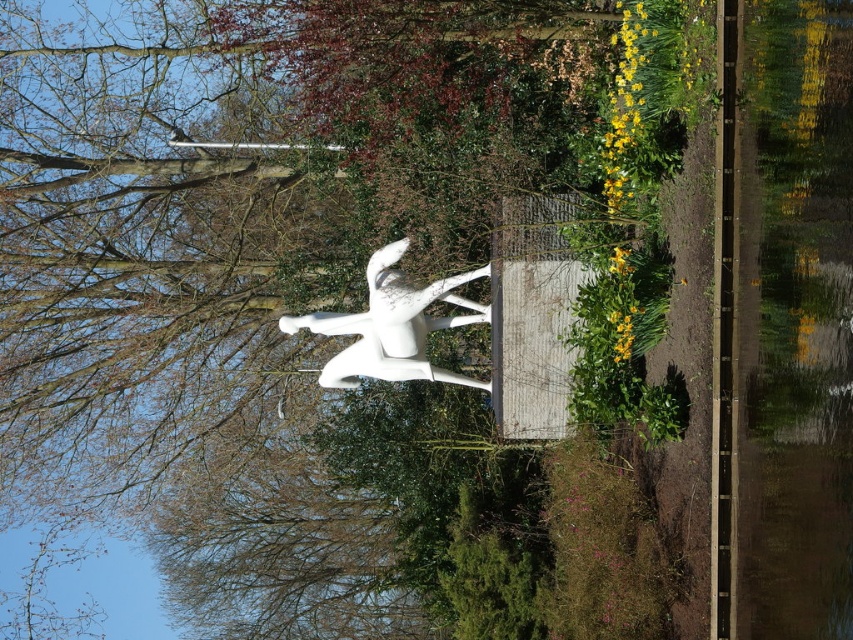
Question: Can you confirm if transparent glass water at right is positioned below white glossy bird at center?

Choices:
 (A) no
 (B) yes

Answer: (A)

Question: Does transparent glass water at right appear on the left side of white glossy bird at center?

Choices:
 (A) no
 (B) yes

Answer: (A)

Question: Which of the following is the farthest from the observer?

Choices:
 (A) pyautogui.click(x=302, y=326)
 (B) pyautogui.click(x=808, y=184)

Answer: (A)

Question: Is transparent glass water at right in front of white glossy bird at center?

Choices:
 (A) no
 (B) yes

Answer: (B)